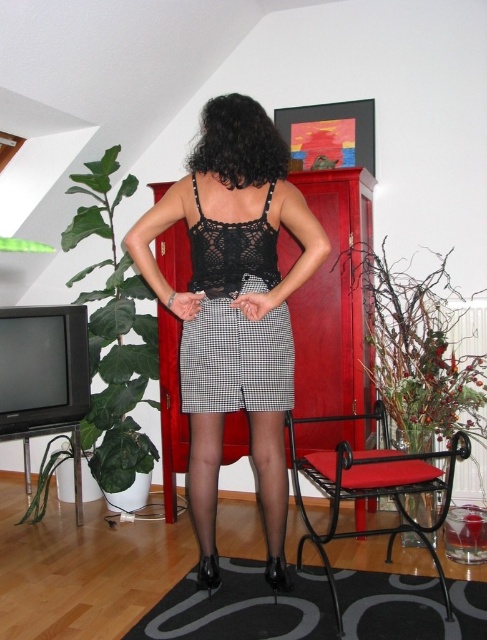
Question: Which point is closer to the camera?

Choices:
 (A) black metal chair at lower right
 (B) black lace dress at center

Answer: (A)

Question: Among these objects, which one is farthest from the camera?

Choices:
 (A) black lace dress at center
 (B) black mesh top at center
 (C) black metal chair at lower right

Answer: (A)

Question: From the image, what is the correct spatial relationship of black mesh top at center in relation to black lace dress at center?

Choices:
 (A) left
 (B) right

Answer: (A)

Question: Considering the real-world distances, which object is farthest from the black lace dress at center?

Choices:
 (A) black metal chair at lower right
 (B) black mesh top at center

Answer: (A)

Question: Is black lace dress at center to the right of black metal chair at lower right from the viewer's perspective?

Choices:
 (A) no
 (B) yes

Answer: (A)

Question: Is black lace dress at center positioned at the back of black metal chair at lower right?

Choices:
 (A) no
 (B) yes

Answer: (B)